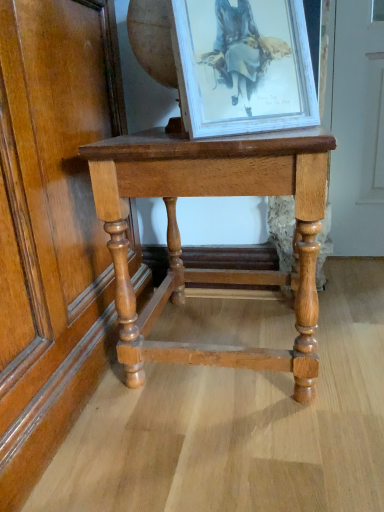
Question: Is light brown wood table at center aimed at white wood picture frame at upper center?

Choices:
 (A) no
 (B) yes

Answer: (A)

Question: From the image's perspective, is light brown wood table at center over white wood picture frame at upper center?

Choices:
 (A) no
 (B) yes

Answer: (A)

Question: Would you say white wood picture frame at upper center is part of light brown wood table at center's contents?

Choices:
 (A) yes
 (B) no

Answer: (B)

Question: From a real-world perspective, is light brown wood table at center on white wood picture frame at upper center?

Choices:
 (A) yes
 (B) no

Answer: (B)

Question: From the image's perspective, does light brown wood table at center appear lower than white wood picture frame at upper center?

Choices:
 (A) yes
 (B) no

Answer: (A)

Question: Can you confirm if light brown wood table at center is taller than white wood picture frame at upper center?

Choices:
 (A) yes
 (B) no

Answer: (A)

Question: Is white wood picture frame at upper center closer to the viewer compared to light brown wood table at center?

Choices:
 (A) yes
 (B) no

Answer: (A)

Question: Is white wood picture frame at upper center surrounding light brown wood table at center?

Choices:
 (A) no
 (B) yes

Answer: (A)

Question: Can you confirm if white wood picture frame at upper center is taller than light brown wood table at center?

Choices:
 (A) yes
 (B) no

Answer: (B)

Question: From the image's perspective, is white wood picture frame at upper center located above light brown wood table at center?

Choices:
 (A) no
 (B) yes

Answer: (B)

Question: From a real-world perspective, is white wood picture frame at upper center below light brown wood table at center?

Choices:
 (A) no
 (B) yes

Answer: (A)

Question: From a real-world perspective, is white wood picture frame at upper center physically above light brown wood table at center?

Choices:
 (A) yes
 (B) no

Answer: (A)

Question: Looking at the image, does white wood picture frame at upper center seem bigger or smaller compared to light brown wood table at center?

Choices:
 (A) big
 (B) small

Answer: (B)